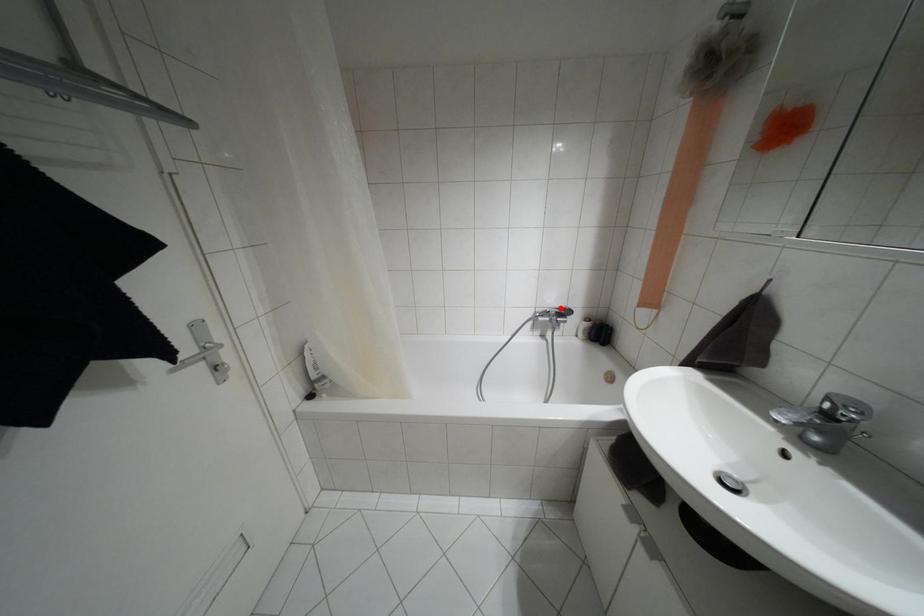
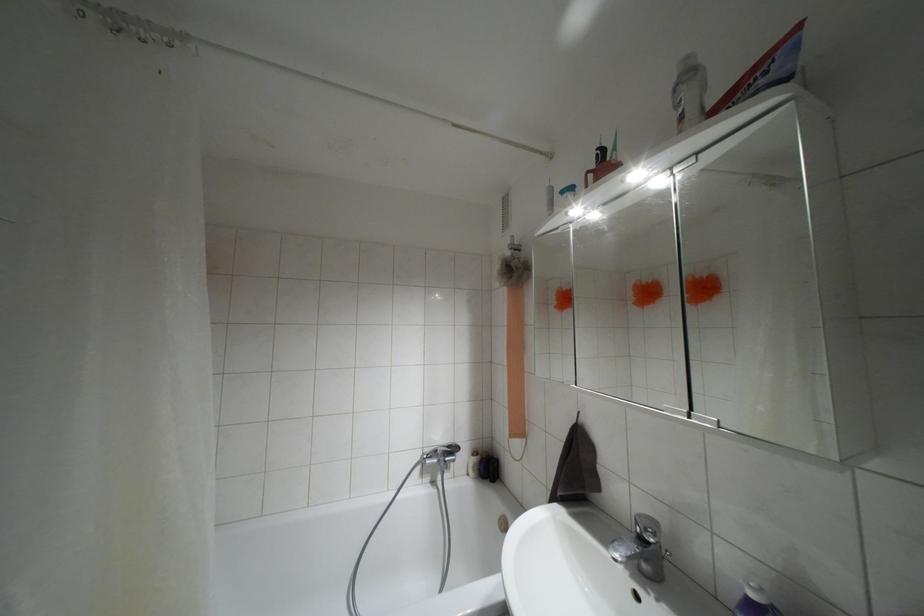
Where in the second image is the point corresponding to the highlighted location from the first image?

(447, 446)